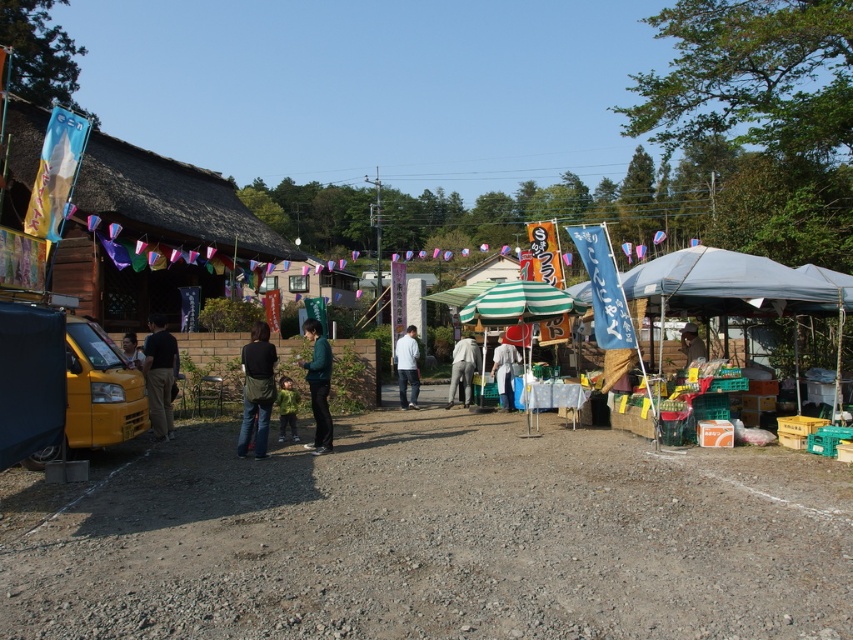
Question: Which of the following is the closest to the observer?

Choices:
 (A) (256, 378)
 (B) (259, 499)

Answer: (B)

Question: Estimate the real-world distances between objects in this image. Which object is closer to the dark blue jeans at center?

Choices:
 (A) green fuzzy jacket at center
 (B) dark green sweater at center
 (C) light gray fabric pants at center
 (D) matte black shirt at left

Answer: (B)

Question: Which of the following is the closest to the observer?

Choices:
 (A) matte black shirt at left
 (B) light gray fabric pants at center
 (C) dark green sweater at center
 (D) dark brown fabric at left

Answer: (C)

Question: Where is white fabric umbrella at center located in relation to matte black shirt at left in the image?

Choices:
 (A) left
 (B) right

Answer: (B)

Question: Does brown gravel dirt track at lower center appear over green fuzzy jacket at center?

Choices:
 (A) no
 (B) yes

Answer: (A)

Question: Is dark brown fabric at left bigger than white matte shirt at center?

Choices:
 (A) yes
 (B) no

Answer: (A)